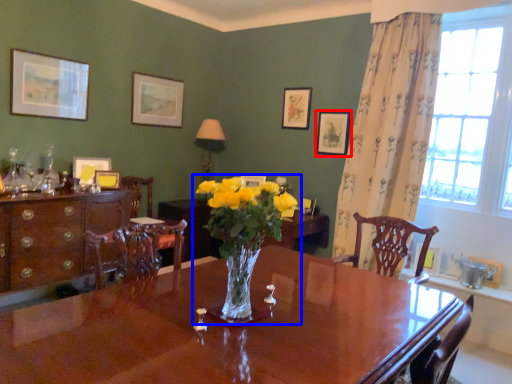
Question: Which object is closer to the camera taking this photo, picture frame (highlighted by a red box) or houseplant (highlighted by a blue box)?

Choices:
 (A) picture frame
 (B) houseplant

Answer: (B)